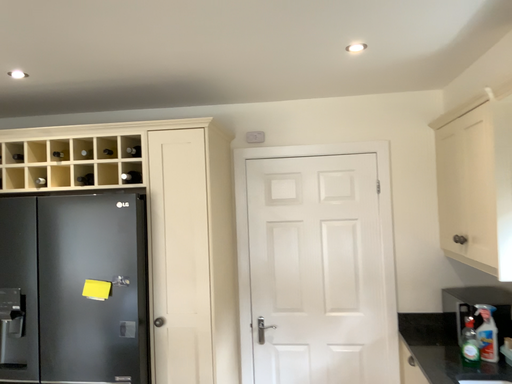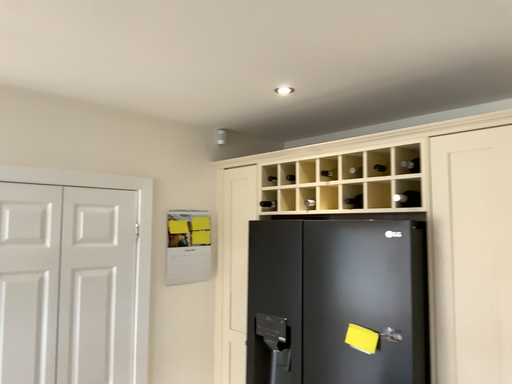
Question: Which way did the camera rotate in the video?

Choices:
 (A) rotated left
 (B) rotated right

Answer: (A)